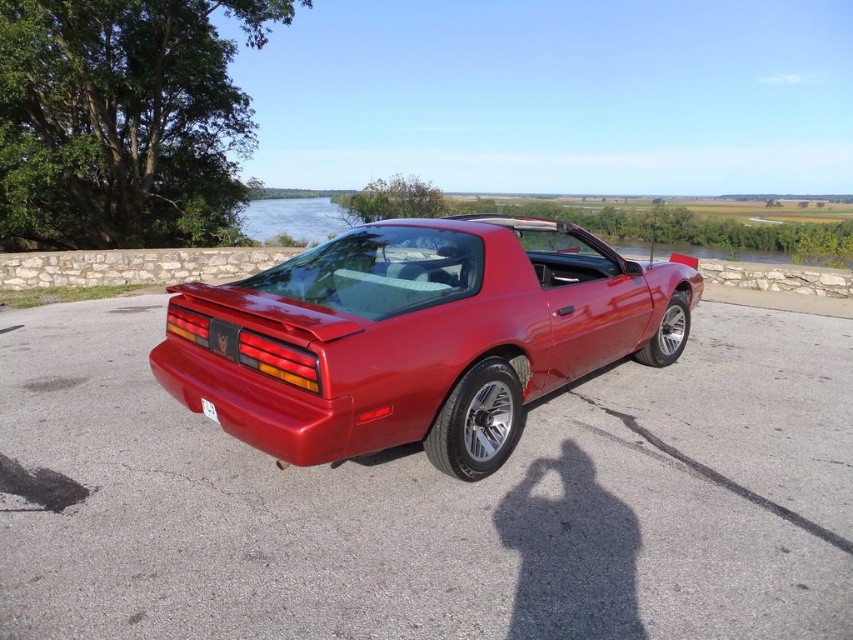
You are a photographer trying to capture the glossy metallic car at center and the white plastic license plate at lower center in the same frame. Based on their positions, which object should you adjust your camera to focus on first to ensure both are in the frame?

The glossy metallic car at center is to the right of white plastic license plate at lower center. To capture both in the same frame, you should first focus on the white plastic license plate at lower center since it is on the left side, allowing you to adjust the camera to include the car on the right.

You are a photographer trying to capture the glossy metallic car at center and the white plastic license plate at lower center in a single frame. Since you want the license plate to be clearly visible, would the car block the view of the license plate due to its height?

The glossy metallic car at center is taller than the white plastic license plate at lower center. However, since the license plate is positioned at the lower center, it is likely placed on the car itself, such as on the rear bumper. Therefore, the car would not block the view of its own license plate. You can adjust your angle to ensure both are visible.